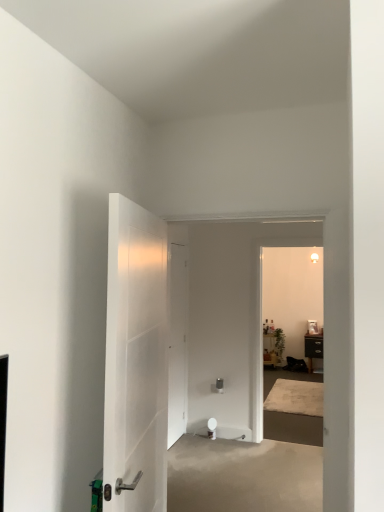
Question: Is white glossy door at center, the 1th door when ordered from front to back, shorter than black matte cabinet at right, which is counted as the 2th furniture, starting from the left?

Choices:
 (A) yes
 (B) no

Answer: (B)

Question: Is white glossy door at center, marked as the 2th door in a back-to-front arrangement, not inside black matte cabinet at right, the 1th furniture viewed from the right?

Choices:
 (A) no
 (B) yes

Answer: (B)

Question: From the image's perspective, is white glossy door at center, marked as the 2th door in a back-to-front arrangement, located above black matte cabinet at right, the 1th furniture viewed from the right?

Choices:
 (A) no
 (B) yes

Answer: (B)

Question: From the image's perspective, is white glossy door at center, marked as the 2th door in a back-to-front arrangement, beneath black matte cabinet at right, which is counted as the 2th furniture, starting from the left?

Choices:
 (A) yes
 (B) no

Answer: (B)

Question: Is white glossy door at center, marked as the 2th door in a back-to-front arrangement, bigger than black matte cabinet at right, which is counted as the 2th furniture, starting from the left?

Choices:
 (A) yes
 (B) no

Answer: (A)

Question: Does white glossy door at center, marked as the 2th door in a back-to-front arrangement, have a greater width compared to black matte cabinet at right, the 1th furniture viewed from the right?

Choices:
 (A) no
 (B) yes

Answer: (A)

Question: From a real-world perspective, is white glossy door at center, marked as the 2th door in a back-to-front arrangement, over wooden side table at center, which is the second furniture in right-to-left order?

Choices:
 (A) yes
 (B) no

Answer: (A)

Question: Considering the relative sizes of white glossy door at center, the 1th door when ordered from front to back, and wooden side table at center, which ranks as the first furniture in left-to-right order, in the image provided, is white glossy door at center, the 1th door when ordered from front to back, smaller than wooden side table at center, which ranks as the first furniture in left-to-right order,?

Choices:
 (A) no
 (B) yes

Answer: (A)

Question: From the image's perspective, is white glossy door at center, marked as the 2th door in a back-to-front arrangement, above wooden side table at center, which ranks as the first furniture in left-to-right order?

Choices:
 (A) yes
 (B) no

Answer: (A)

Question: Considering the relative positions of white glossy door at center, the 1th door when ordered from front to back, and wooden side table at center, which ranks as the first furniture in left-to-right order, in the image provided, is white glossy door at center, the 1th door when ordered from front to back, to the right of wooden side table at center, which ranks as the first furniture in left-to-right order, from the viewer's perspective?

Choices:
 (A) no
 (B) yes

Answer: (A)

Question: Is white glossy door at center, marked as the 2th door in a back-to-front arrangement, taller than wooden side table at center, which ranks as the first furniture in left-to-right order?

Choices:
 (A) no
 (B) yes

Answer: (B)

Question: Is white glossy door at center, marked as the 2th door in a back-to-front arrangement, positioned behind wooden side table at center, which is the second furniture in right-to-left order?

Choices:
 (A) yes
 (B) no

Answer: (B)

Question: Considering the relative sizes of beige concrete at center and white matte door at center, positioned as the 2th door in front-to-back order, in the image provided, is beige concrete at center wider than white matte door at center, positioned as the 2th door in front-to-back order,?

Choices:
 (A) no
 (B) yes

Answer: (B)